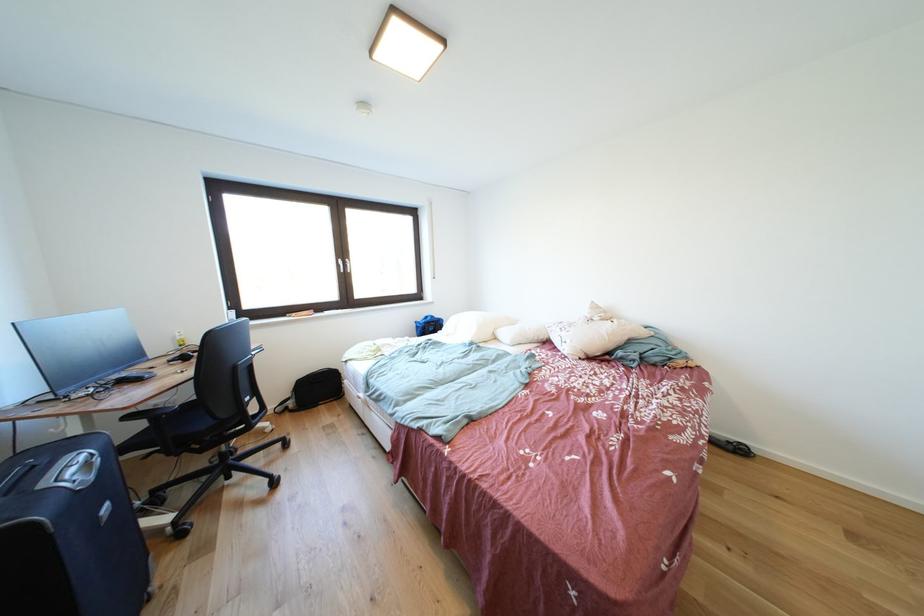
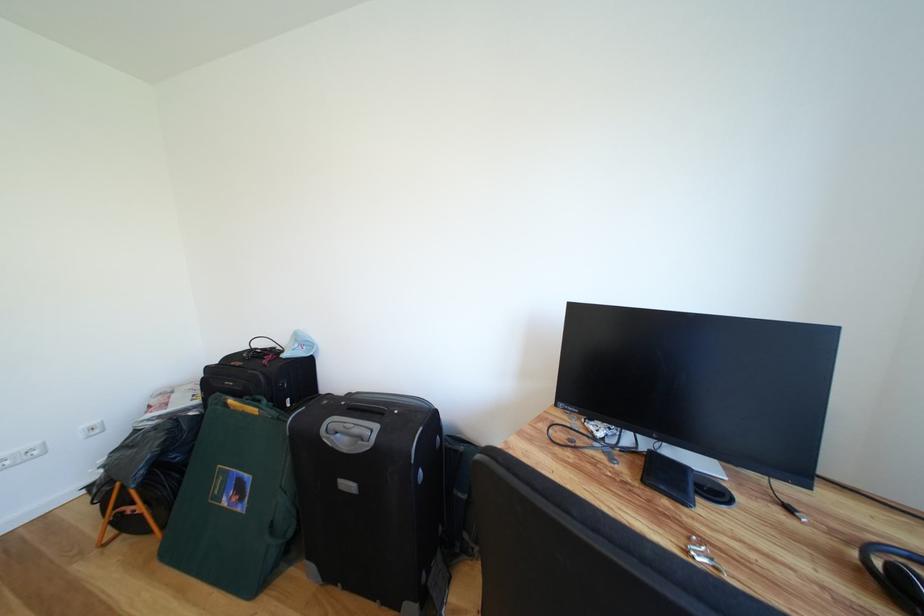
Where in the second image is the point corresponding to (101,483) from the first image?

(353, 455)